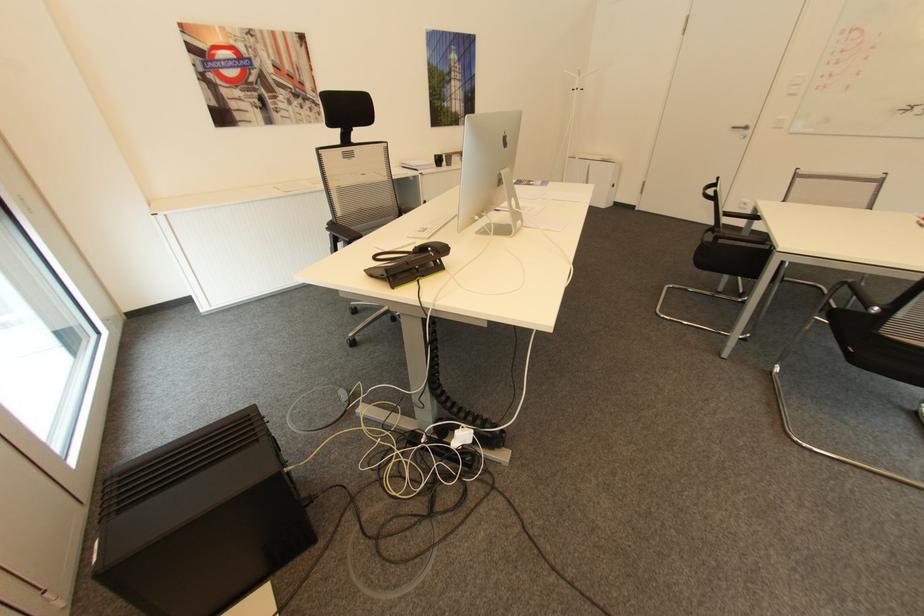
Where is `white coat rack hook`? white coat rack hook is located at coordinates (570, 71).